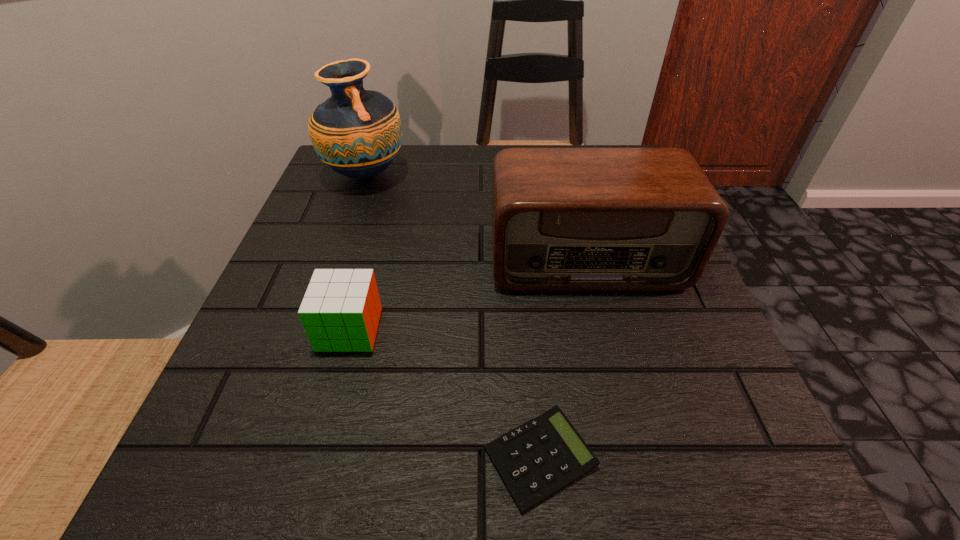
Identify the location of the tallest object. Image resolution: width=960 pixels, height=540 pixels. (357, 133).

Locate an element on the screen. The image size is (960, 540). pottery is located at coordinates (357, 133).

At what (x,y) coordinates should I click in order to perform the action: click on the second tallest object. Please return your answer as a coordinate pair (x, y). Image resolution: width=960 pixels, height=540 pixels. Looking at the image, I should click on (563, 219).

Locate an element on the screen. This screenshot has width=960, height=540. the second farthest object is located at coordinates point(563,219).

Locate an element on the screen. The image size is (960, 540). the third farthest object is located at coordinates (340, 311).

The height and width of the screenshot is (540, 960). Find the location of `the second shortest object`. the second shortest object is located at coordinates (340, 311).

Where is `calculator`? The image size is (960, 540). calculator is located at coordinates (537, 459).

Locate an element on the screen. This screenshot has height=540, width=960. the shortest object is located at coordinates (537, 459).

Locate an element on the screen. This screenshot has height=540, width=960. vacant area situated 0.180m on the front of the tallest object is located at coordinates (338, 255).

Where is `vacant region located 0.080m on the front panel of the radio receiver`? Image resolution: width=960 pixels, height=540 pixels. vacant region located 0.080m on the front panel of the radio receiver is located at coordinates (604, 330).